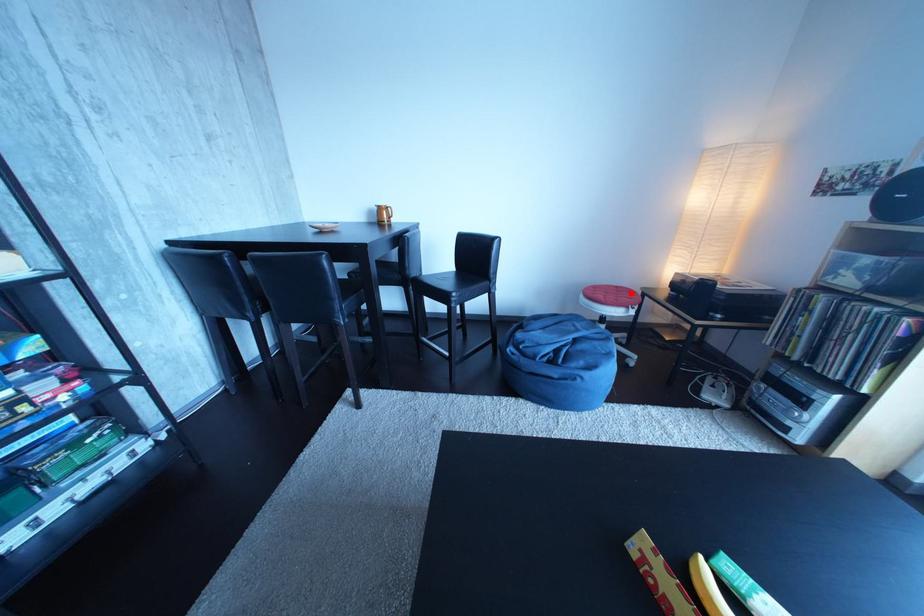
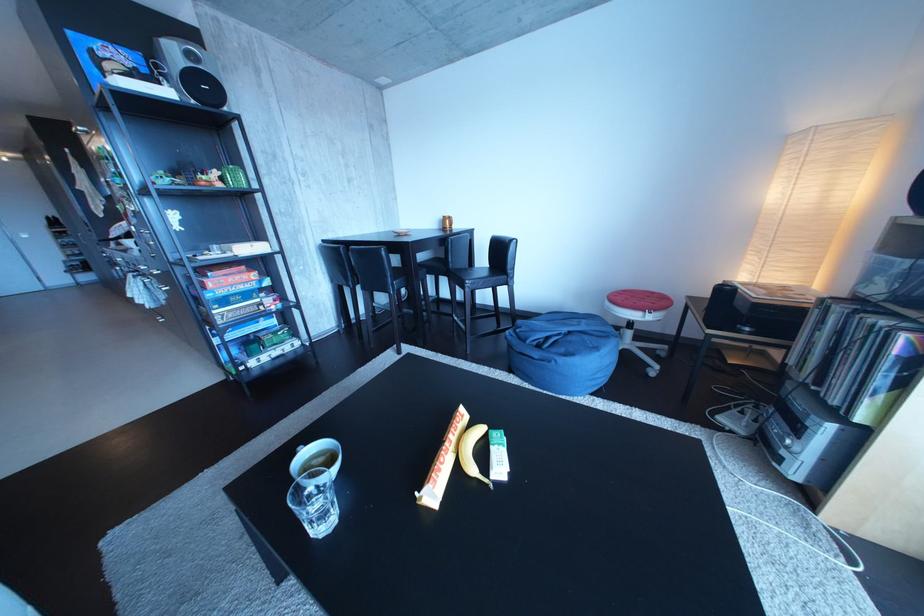
In the second image, find the point that corresponds to the highlighted location in the first image.

(666, 299)